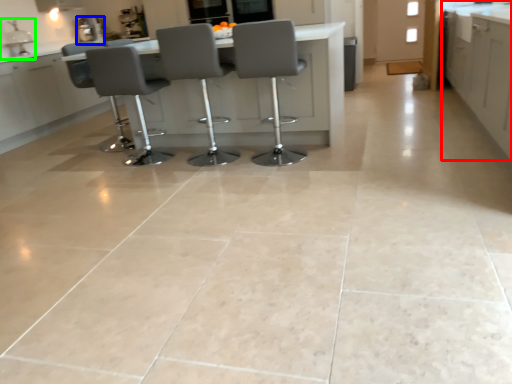
Question: Which object is the closest to the cabinetry (highlighted by a red box)? Choose among these: appliance (highlighted by a blue box) or sink (highlighted by a green box).

Choices:
 (A) appliance
 (B) sink

Answer: (A)